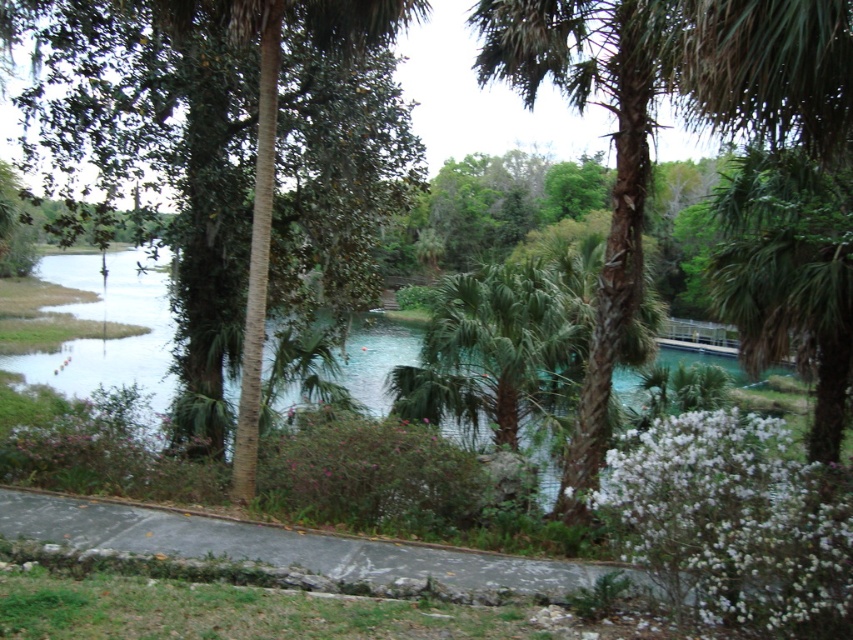
You are standing at the edge of the pathway and want to take a photo of the brown textured palm tree at center. Your camera has a maximum focus range of 4 meters. Will the camera be able to focus on the palm tree?

The brown textured palm tree at center is 4.09 meters from camera, which is slightly beyond the camera maximum focus range of 4 meters. The camera will not be able to focus on the palm tree.

You are standing at the entrance of the park and want to locate the green leafy palm tree at center. Based on the coordinates provided, where should you look to find it?

The green leafy palm tree at center is located at coordinates point (494, 349).